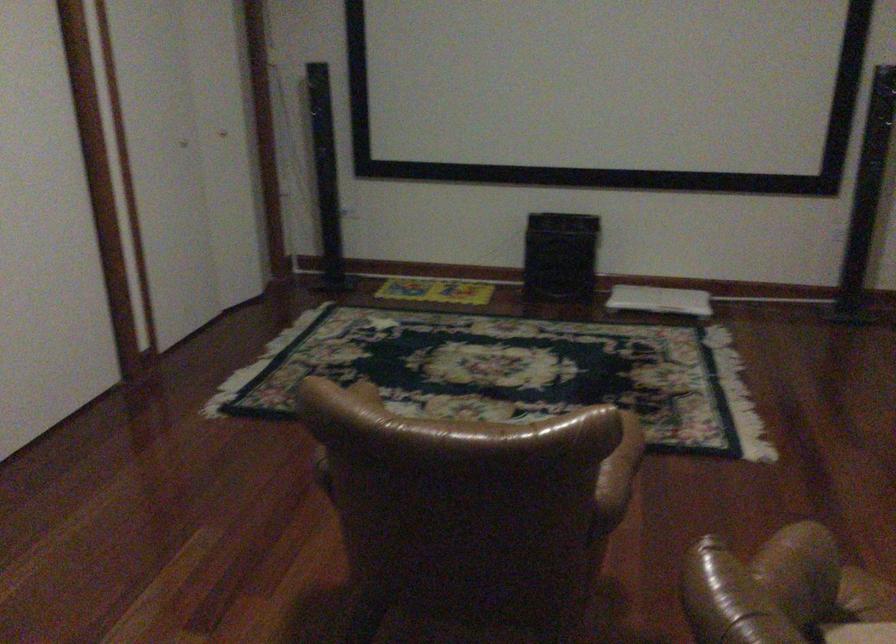
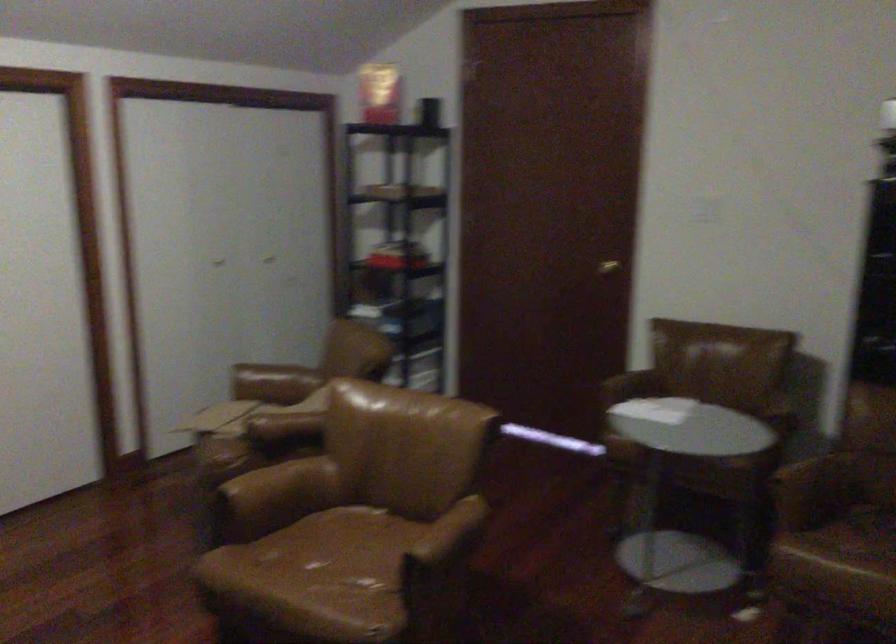
In the second image, find the point that corresponds to pixel 614 474 in the first image.

(280, 484)